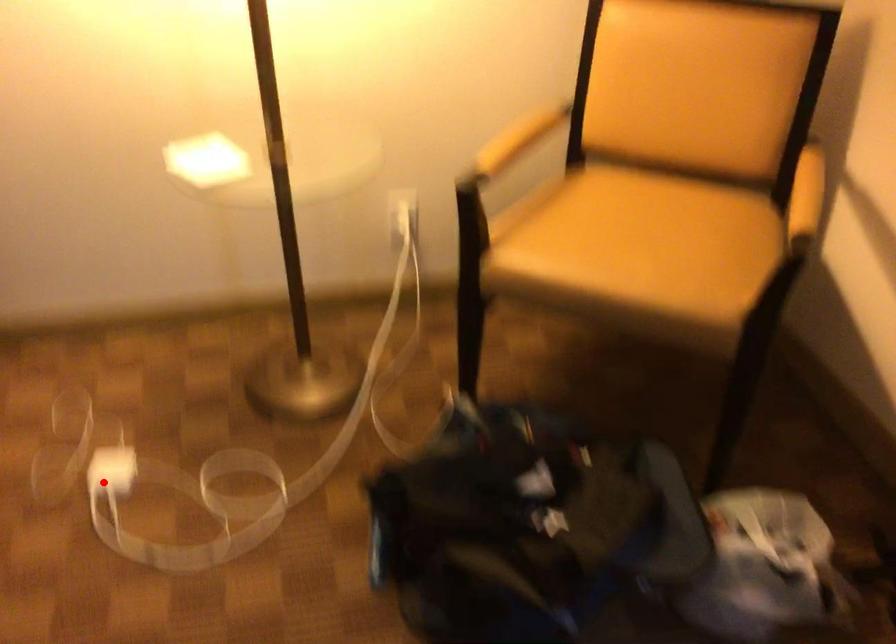
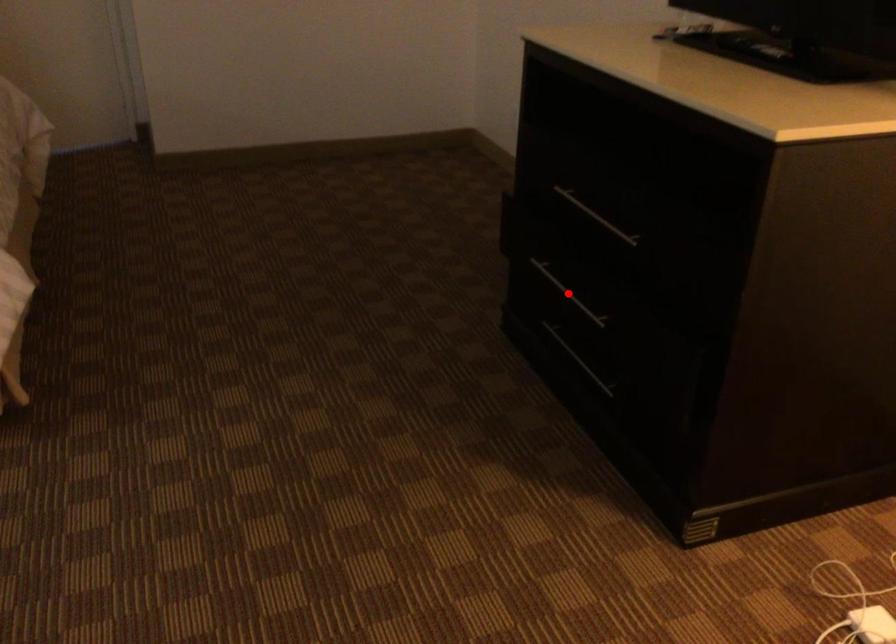
I am providing you with two images of the same scene from different viewpoints. A red point is marked on the first image and another point is marked on the second image. Do the highlighted points in image1 and image2 indicate the same real-world spot?

No